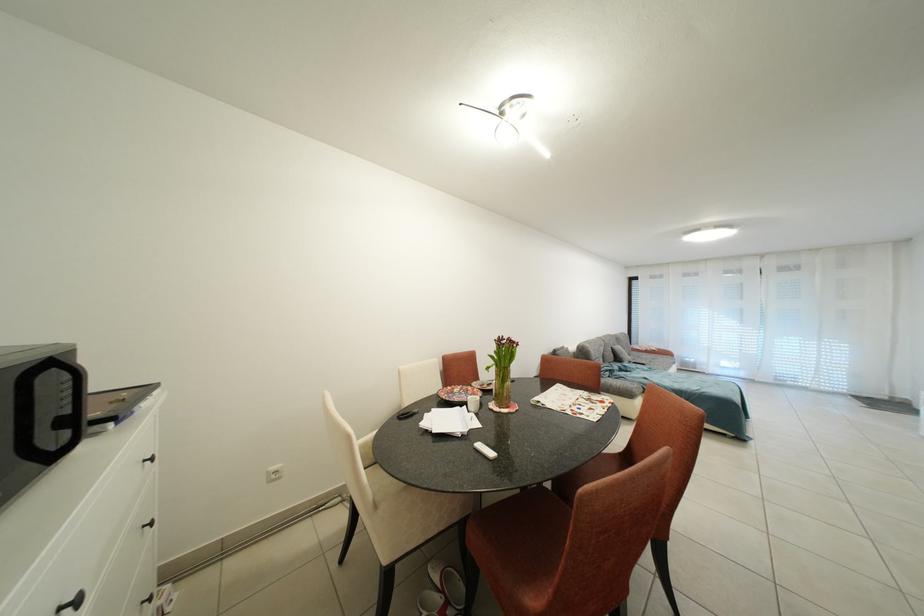
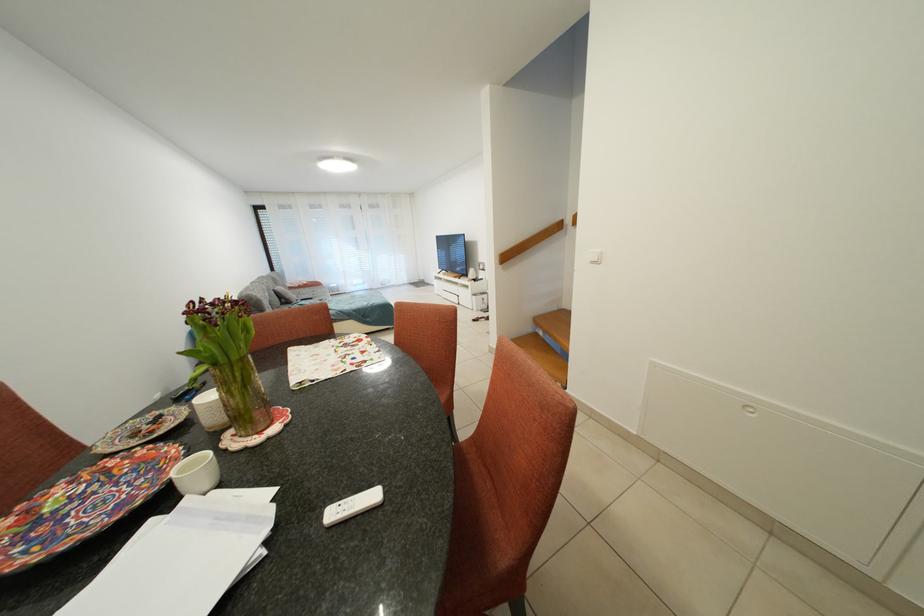
Locate, in the second image, the point that corresponds to (500,458) in the first image.

(382, 501)